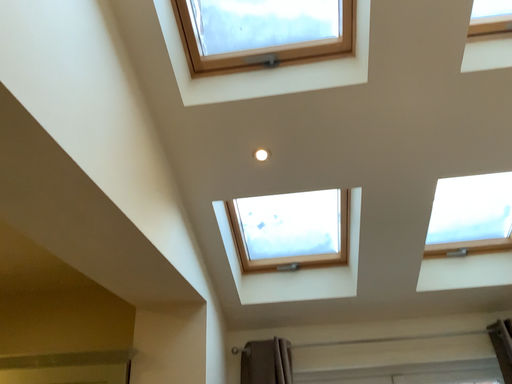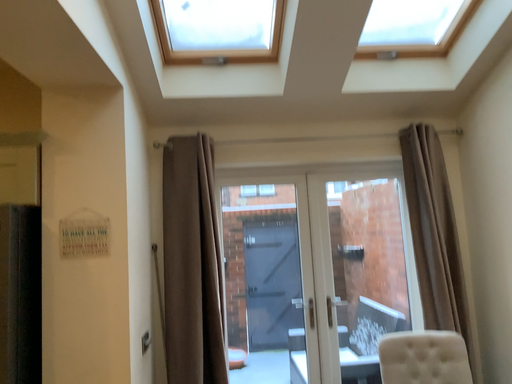
Question: Which way did the camera rotate in the video?

Choices:
 (A) rotated left
 (B) rotated right

Answer: (B)